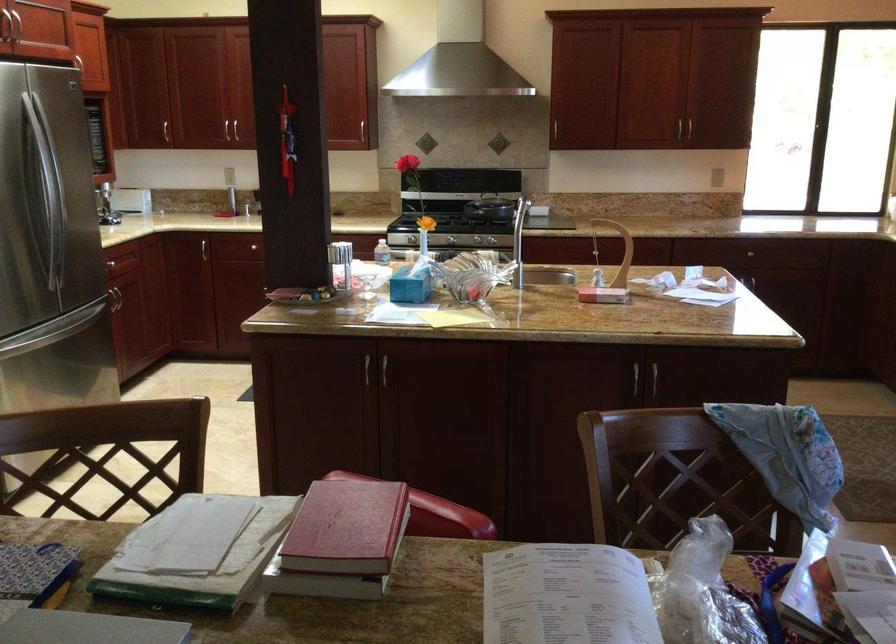
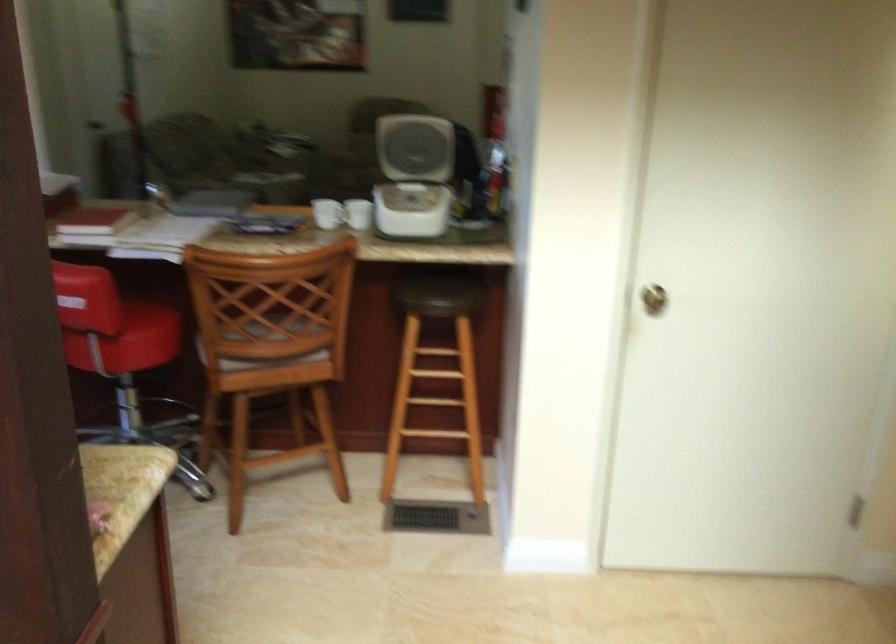
Locate, in the second image, the point that corresponds to (x=331, y=494) in the first image.

(93, 223)